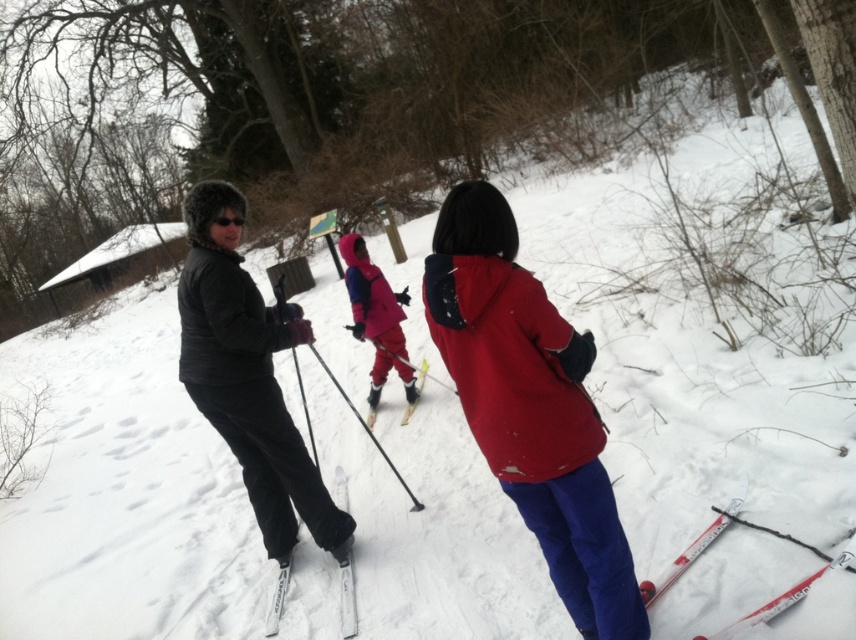
Question: Estimate the real-world distances between objects in this image. Which object is farther from the matte pink snowsuit at center?

Choices:
 (A) white plastic ski at lower right
 (B) yellow plastic ski at center
 (C) black fuzzy hat at left

Answer: (A)

Question: Which of the following is the farthest from the observer?

Choices:
 (A) matte red jacket at center
 (B) white matte ski at center
 (C) yellow matte ski at center
 (D) black fuzzy hat at left

Answer: (C)

Question: Can you confirm if matte red jacket at center is positioned to the right of matte pink snowsuit at center?

Choices:
 (A) yes
 (B) no

Answer: (A)

Question: Can you confirm if black fuzzy hat at left is wider than white plastic ski at lower right?

Choices:
 (A) yes
 (B) no

Answer: (A)

Question: Which object appears farthest from the camera in this image?

Choices:
 (A) white matte ski at center
 (B) matte red jacket at center

Answer: (A)

Question: Does matte red jacket at center lie in front of black fuzzy hat at left?

Choices:
 (A) no
 (B) yes

Answer: (B)